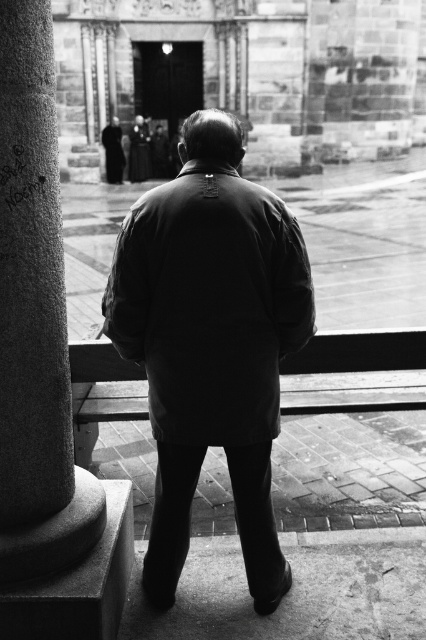
You are standing behind the person in the image and want to move to the doorway in the background. Which direction should you go around the matte black jacket at center to avoid the granite column at left?

You should go to the right of the matte black jacket at center to avoid the granite column at left, since the granite column at left is located to the left side of the matte black jacket at center.